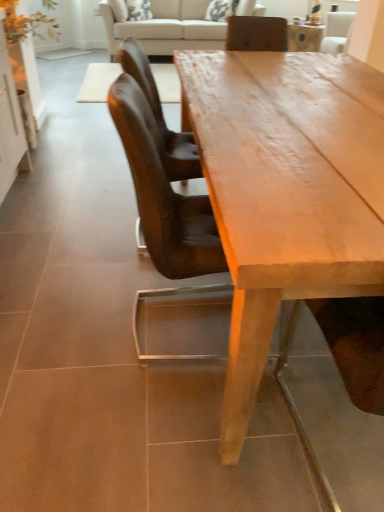
Question: Is point (137, 53) closer or farther from the camera than point (140, 27)?

Choices:
 (A) closer
 (B) farther

Answer: (A)

Question: From the image's perspective, relative to beige fabric couch at upper center, is leather chair at center, positioned as the 1th chair in back-to-front order, above or below?

Choices:
 (A) above
 (B) below

Answer: (B)

Question: Which object is the farthest from the white glossy cabinet at left?

Choices:
 (A) beige fabric couch at upper center
 (B) leather chair at center, which appears as the 2th chair when viewed from the front
 (C) brown leather chair at center, marked as the second chair in a back-to-front arrangement
 (D) smooth wooden table at center

Answer: (A)

Question: Based on their relative distances, which object is farther from the leather chair at center, positioned as the 1th chair in back-to-front order?

Choices:
 (A) white glossy cabinet at left
 (B) smooth wooden table at center
 (C) beige fabric couch at upper center
 (D) brown leather chair at center, marked as the second chair in a back-to-front arrangement

Answer: (C)